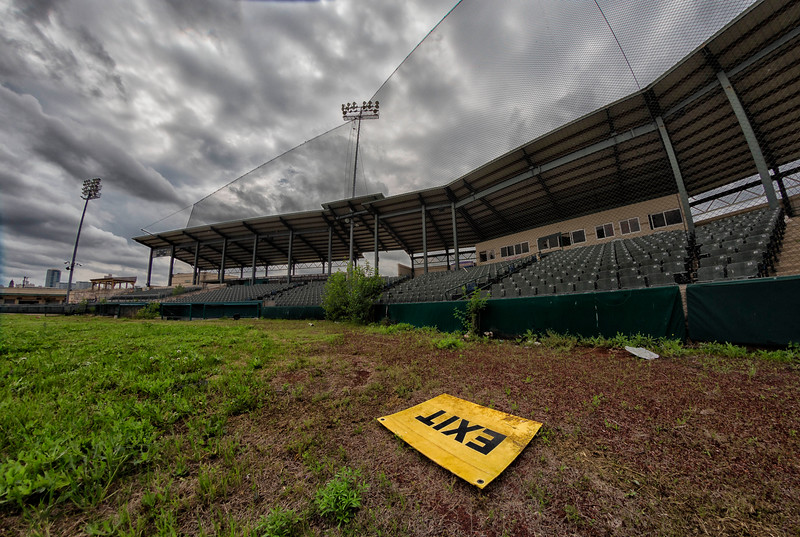
You are a GUI agent. You are given a task and a screenshot of the screen. Output one action in this format:
    pyautogui.click(x=<x>, y=<y>)
    Task: Click on the stairs
    The image size is (800, 537).
    Given the screenshot: What is the action you would take?
    tap(790, 253)